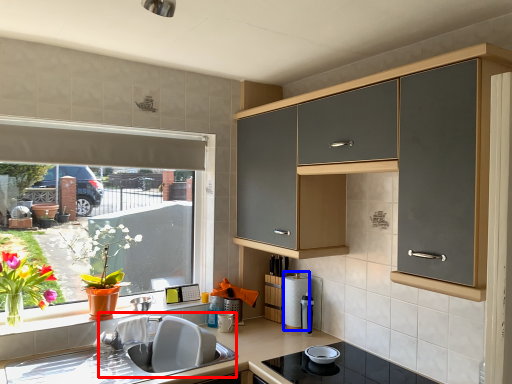
Question: Which object appears closest to the camera in this image, sink (highlighted by a red box) or appliance (highlighted by a blue box)?

Choices:
 (A) sink
 (B) appliance

Answer: (A)